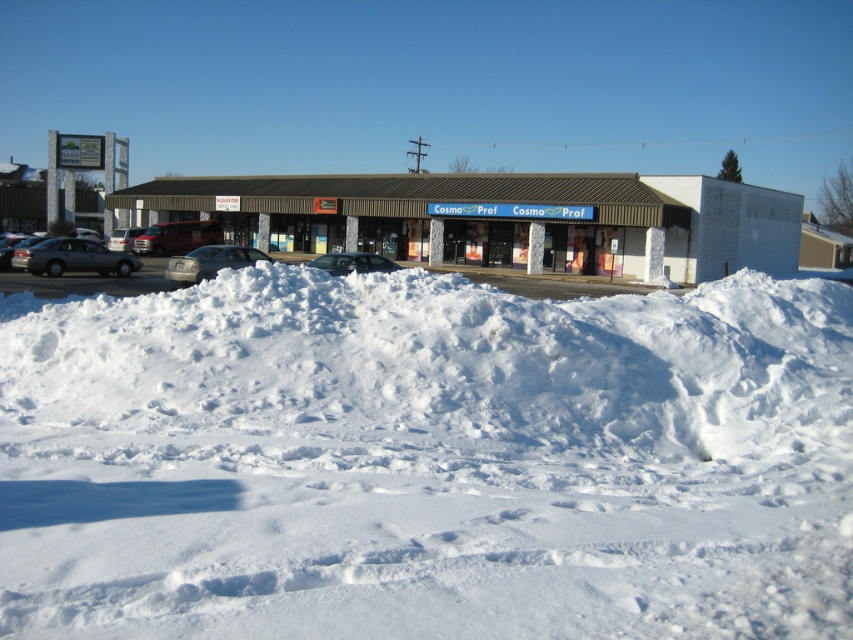
Is point (88, 252) closer to viewer compared to point (149, 243)?

Yes, it is.

Is satin silver sedan at left above metallic red truck at center?

Actually, satin silver sedan at left is below metallic red truck at center.

Is point (36, 266) farther from camera compared to point (167, 225)?

No, it is not.

The width and height of the screenshot is (853, 640). I want to click on satin silver sedan at left, so click(x=73, y=257).

Is white fluffy snow at lower center shorter than silver metallic van at left?

Yes.

Is point (161, 611) more distant than point (113, 237)?

That is False.

Image resolution: width=853 pixels, height=640 pixels. In order to click on white fluffy snow at lower center in this screenshot , I will do `click(427, 460)`.

Is satin silver sedan at center thinner than silver metallic van at left?

Incorrect, satin silver sedan at center's width is not less than silver metallic van at left's.

Between point (213, 266) and point (132, 230), which one is positioned behind?

The point (132, 230) is more distant.

This screenshot has height=640, width=853. Find the location of `satin silver sedan at center`. satin silver sedan at center is located at coordinates (210, 260).